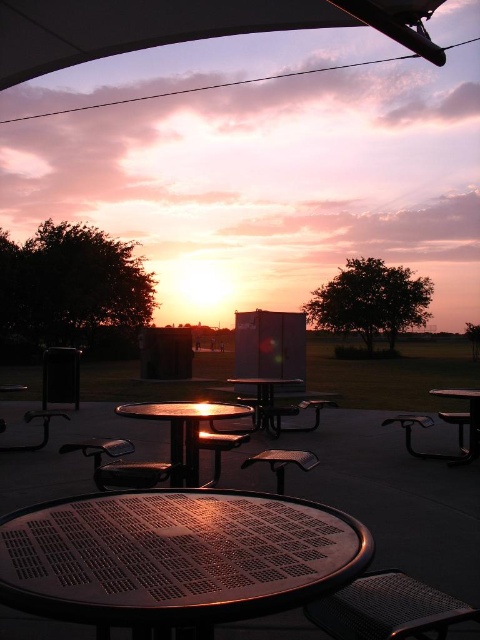
Can you confirm if metallic brown stool at center is positioned to the left of metallic silver table at lower right?

Correct, you'll find metallic brown stool at center to the left of metallic silver table at lower right.

Is point (252, 460) more distant than point (462, 461)?

No, it is not.

The width and height of the screenshot is (480, 640). Find the location of `metallic brown stool at center`. metallic brown stool at center is located at coordinates (283, 461).

Does point (169, 424) come farther from viewer compared to point (455, 397)?

That is False.

Does metallic round table at center have a greater height compared to metallic silver table at lower right?

Incorrect, metallic round table at center's height is not larger of metallic silver table at lower right's.

Identify the location of metallic round table at center. (182, 429).

Image resolution: width=480 pixels, height=640 pixels. Identify the location of metallic round table at center. (182, 429).

Who is shorter, metallic perforated table at center or metallic round table at center?

metallic perforated table at center is shorter.

Does metallic perforated table at center appear on the left side of metallic round table at center?

No, metallic perforated table at center is not to the left of metallic round table at center.

Describe the element at coordinates (176, 557) in the screenshot. I see `metallic perforated table at center` at that location.

Where is `metallic perforated table at center`? The width and height of the screenshot is (480, 640). metallic perforated table at center is located at coordinates (176, 557).